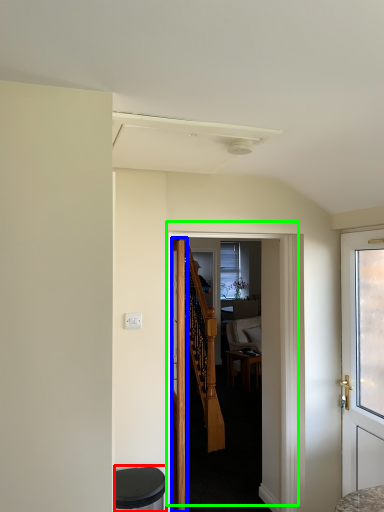
Question: Estimate the real-world distances between objects in this image. Which object is farther from music stool (highlighted by a red box), door (highlighted by a blue box) or door (highlighted by a green box)?

Choices:
 (A) door
 (B) door

Answer: (B)